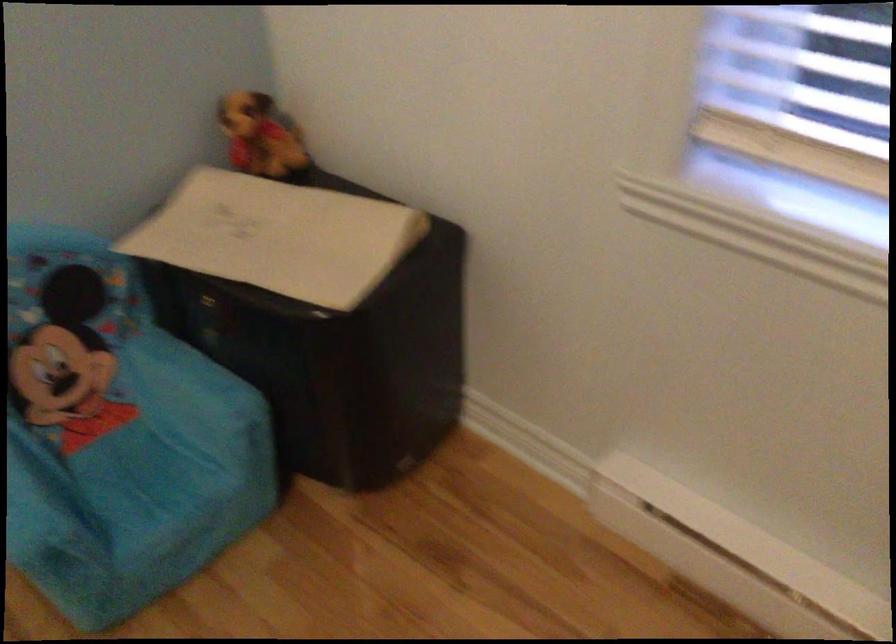
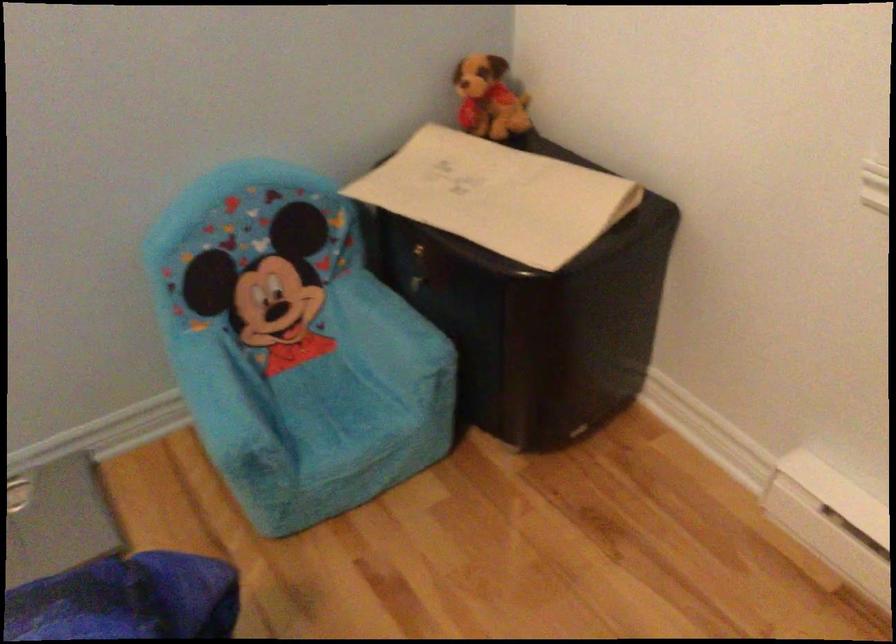
The point at [188,375] is marked in the first image. Where is the corresponding point in the second image?

(389, 316)